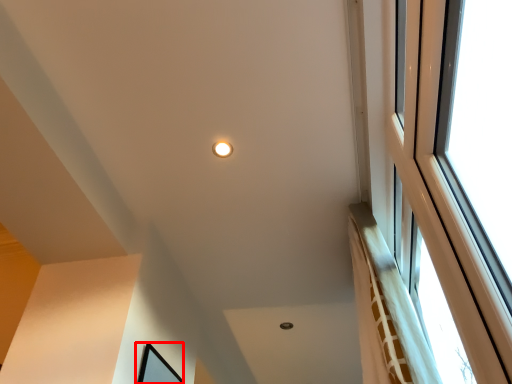
Question: From the image's perspective, where is picture frame (annotated by the red box) located in relation to lighting in the image?

Choices:
 (A) below
 (B) above

Answer: (A)